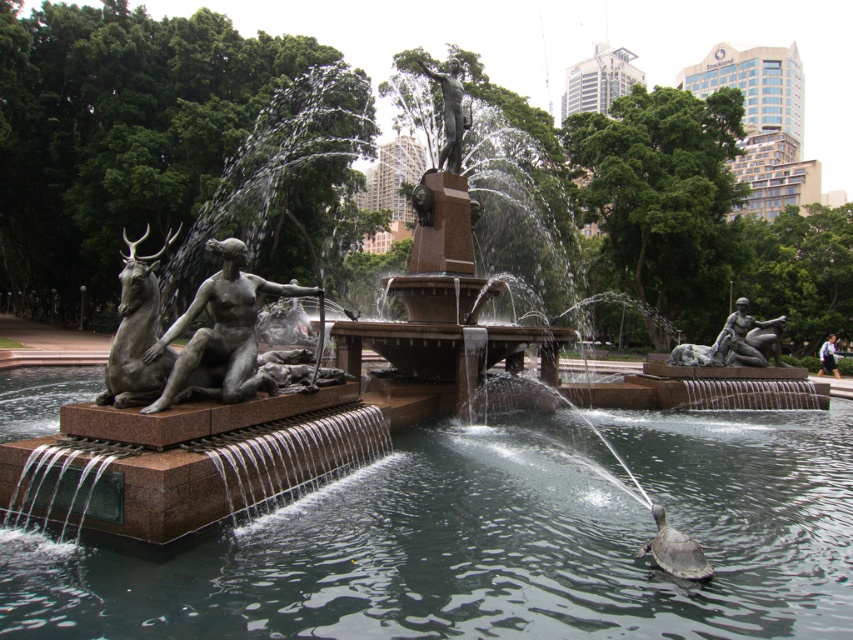
You are a sculptor visiting the fountain and want to compare the heights of the bronze statue at center and the bronze textured deer at left. Which one is taller?

The bronze textured deer at left is taller than the bronze statue at center.

You are standing at the center of the fountain and want to find the bronze textured deer at left. In which direction should you look to see it?

The bronze textured deer at left is located at point coordinates that are to the left side of the fountain, so you should look to your left to see it.

You are a park visitor who wants to take a photo of both the shiny gray turtle at lower right and the bronze statue at upper center in the same frame. Considering their sizes, which one should you zoom in on more to ensure both are visible?

Since the shiny gray turtle at lower right is smaller than the bronze statue at upper center, you should zoom in more on the bronze statue at upper center to balance their sizes in the photo frame.